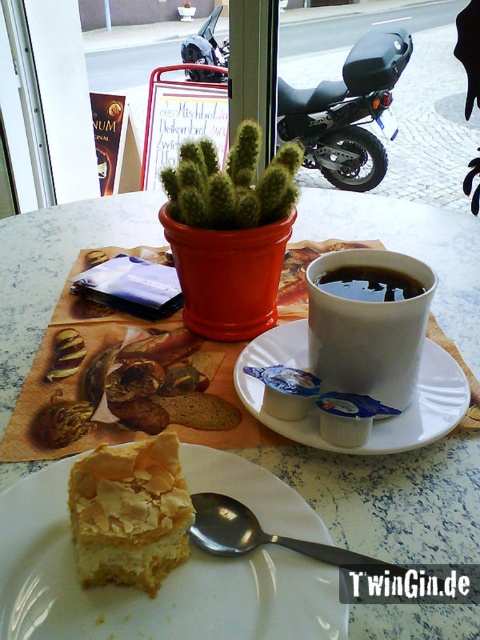
Who is lower down, black matte motorcycle at upper center or green fuzzy cactus at center?

green fuzzy cactus at center is lower down.

Who is more forward, (350, 65) or (186, 216)?

Positioned in front is point (186, 216).

The height and width of the screenshot is (640, 480). I want to click on black matte motorcycle at upper center, so click(x=348, y=112).

Where is `black matte motorcycle at upper center`? The image size is (480, 640). black matte motorcycle at upper center is located at coordinates 348,112.

Is golden flaky pastry at lower left taller than black matte cup at upper center?

Yes, golden flaky pastry at lower left is taller than black matte cup at upper center.

Does golden flaky pastry at lower left appear over black matte cup at upper center?

Actually, golden flaky pastry at lower left is below black matte cup at upper center.

What do you see at coordinates (130, 513) in the screenshot? I see `golden flaky pastry at lower left` at bounding box center [130, 513].

What are the coordinates of `golden flaky pastry at lower left` in the screenshot? It's located at (130, 513).

Is point (321, 227) behind point (274, 346)?

That is True.

Is white marble table at center closer to camera compared to white ceramic saucer at center?

Yes, it is.

This screenshot has height=640, width=480. Identify the location of white marble table at center. (392, 497).